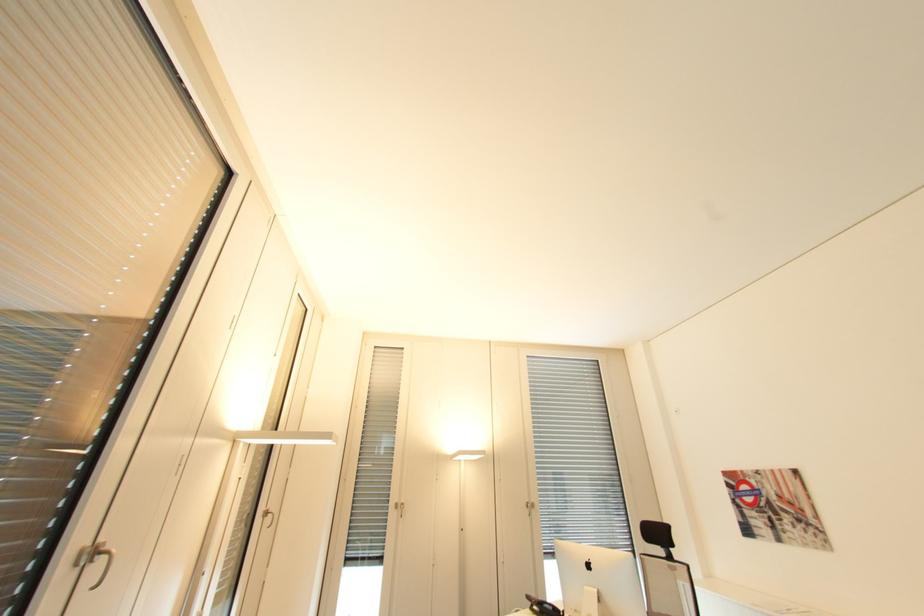
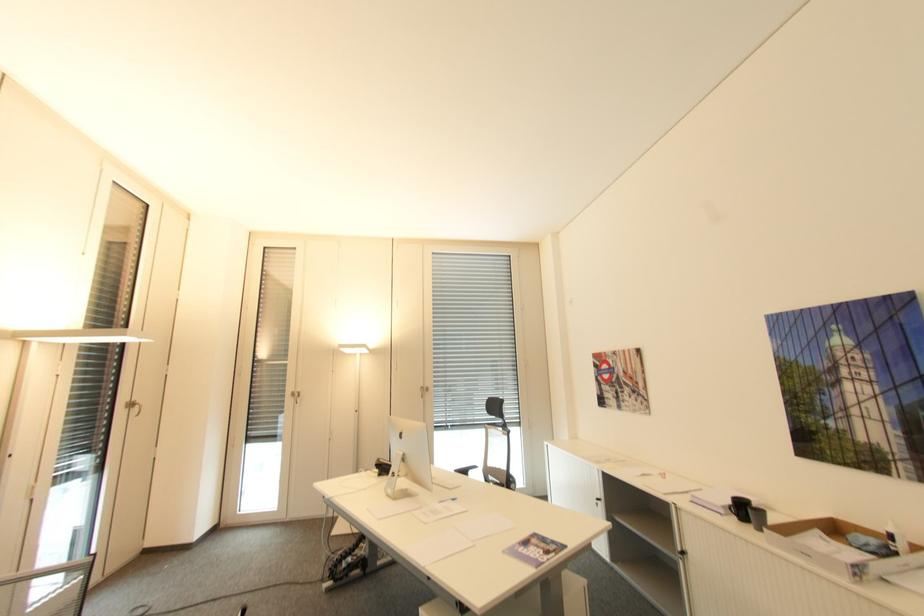
The point at (402,501) is marked in the first image. Where is the corresponding point in the second image?

(298, 390)